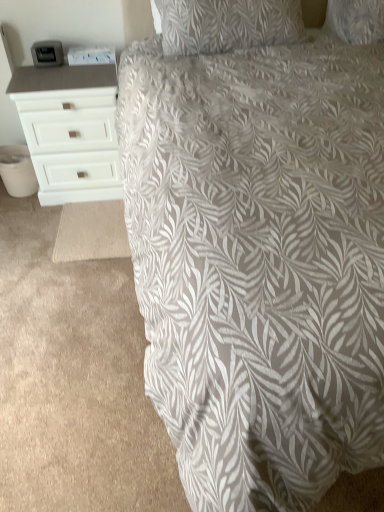
Find the location of a particular element. unoccupied area in front of white matte chest of drawers at left is located at coordinates (70, 237).